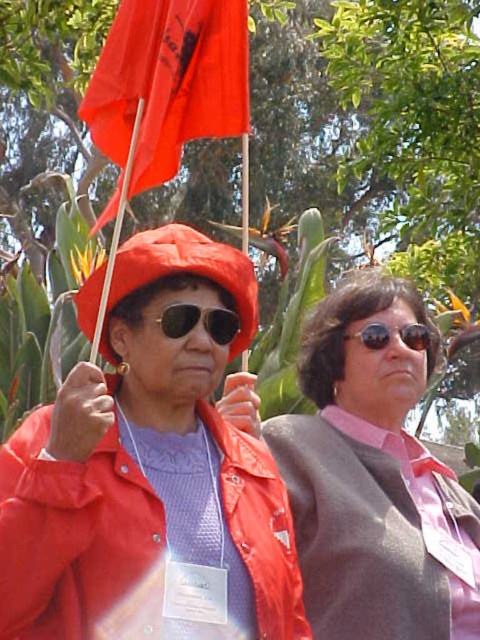
Question: Which point is farther to the camera?

Choices:
 (A) (244, 65)
 (B) (403, 394)
 (C) (160, 269)

Answer: (B)

Question: Does pink satin blouse at center have a smaller size compared to matte orange flag at upper left?

Choices:
 (A) no
 (B) yes

Answer: (A)

Question: Considering the relative positions of matte orange flag at upper left and matte black goggles at center in the image provided, where is matte orange flag at upper left located with respect to matte black goggles at center?

Choices:
 (A) below
 (B) above

Answer: (B)

Question: Among these objects, which one is nearest to the camera?

Choices:
 (A) black reflective sunglasses at center
 (B) matte orange flag at upper left
 (C) matte black goggles at center
 (D) pink satin blouse at center

Answer: (B)

Question: Which is nearer to the matte black goggles at center?

Choices:
 (A) pink satin blouse at center
 (B) black reflective sunglasses at center
 (C) matte red hat at upper left

Answer: (C)

Question: Does matte red hat at upper left have a lesser width compared to matte black goggles at center?

Choices:
 (A) no
 (B) yes

Answer: (A)